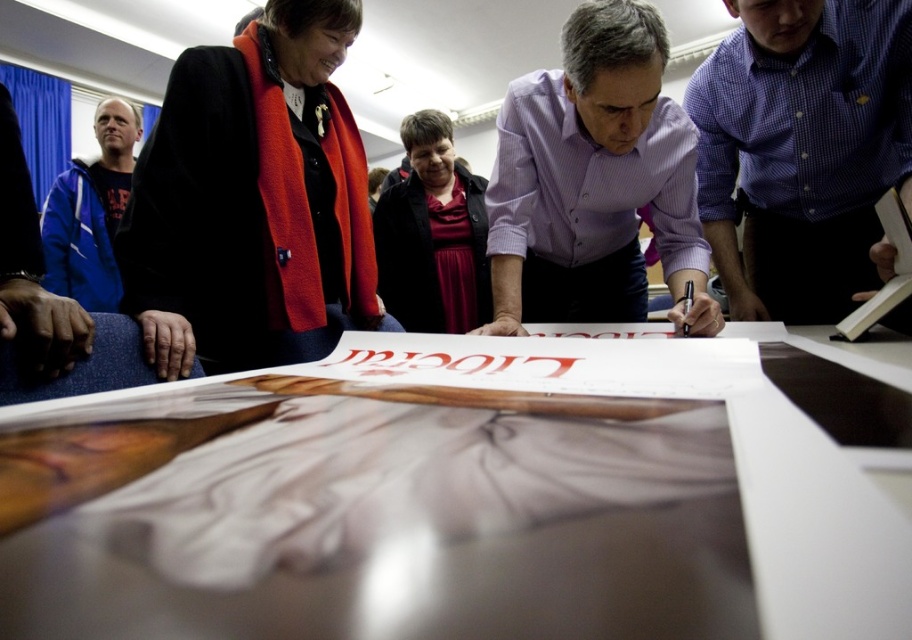
Between white glossy table at center and black woolen coat at upper left, which one has more height?

With more height is black woolen coat at upper left.

Does white glossy table at center have a larger size compared to black woolen coat at upper left?

No, white glossy table at center is not bigger than black woolen coat at upper left.

I want to click on white glossy table at center, so click(436, 516).

Looking at this image, can you confirm if black woolen coat at upper left is wider than black paper at center?

Yes, black woolen coat at upper left is wider than black paper at center.

Who is more distant from viewer, [337,170] or [539,326]?

The point [539,326] is more distant.

Measure the distance between black woolen coat at upper left and camera.

The distance of black woolen coat at upper left from camera is 38.35 inches.

The width and height of the screenshot is (912, 640). I want to click on black woolen coat at upper left, so click(252, 202).

Can you confirm if matte red text at center is taller than black paper at center?

Yes.

Does matte red text at center appear on the left side of black paper at center?

Yes, matte red text at center is to the left of black paper at center.

Where is `matte red text at center`? This screenshot has height=640, width=912. matte red text at center is located at coordinates (443, 364).